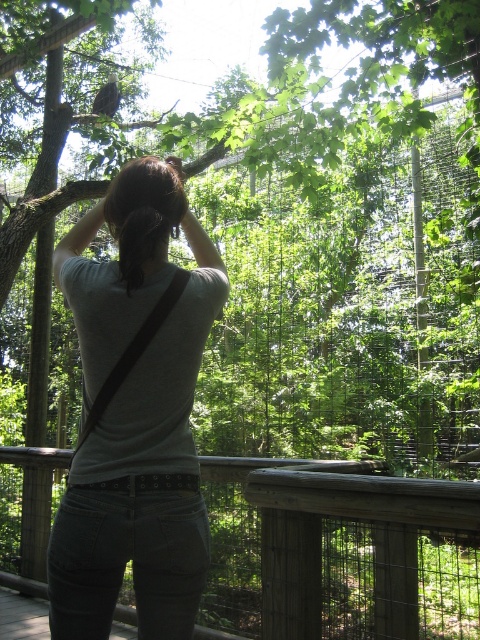
You are a tailor measuring a person for a custom shirt. You need to ensure the shirt fits properly. Given the distance between the gray matte shirt at center and brown hair at upper center is 7.91 inches, what is the minimum required length of the shirt to ensure it reaches from the collar to the bottom hem without being too short?

The minimum required length of the shirt should be at least 7.91 inches to ensure it reaches from the collar at brown hair at upper center to the bottom hem at gray matte shirt at center without being too short.

What are the coordinates of the gray matte shirt at center in the image?

The gray matte shirt at center is located at coordinates 0.650 in the x axis and 0.281 in the y axis.

You are a photographer trying to capture the scene of the person on the deck. You notice the brown hair at upper center and the gray matte shirt at center. Which object should you focus on first to ensure it appears sharp in the photo if you want both to be in focus?

You should focus on the gray matte shirt at center first because the brown hair at upper center is behind it, so ensuring the shirt is in focus will naturally keep the hair in focus as well due to their proximity and alignment.